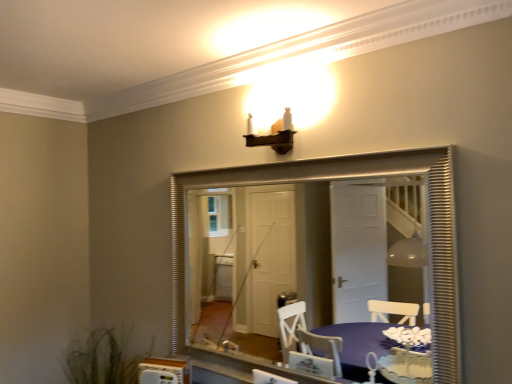
Question: From the image's perspective, is green grass at lower left positioned above or below purple fabric table at lower center?

Choices:
 (A) below
 (B) above

Answer: (A)

Question: Is green grass at lower left inside or outside of purple fabric table at lower center?

Choices:
 (A) inside
 (B) outside

Answer: (B)

Question: Considering the real-world distances, which object is farthest from the green grass at lower left?

Choices:
 (A) purple fabric table at lower center
 (B) silver textured mirror at center

Answer: (B)

Question: Which is nearer to the silver textured mirror at center?

Choices:
 (A) purple fabric table at lower center
 (B) green grass at lower left

Answer: (A)